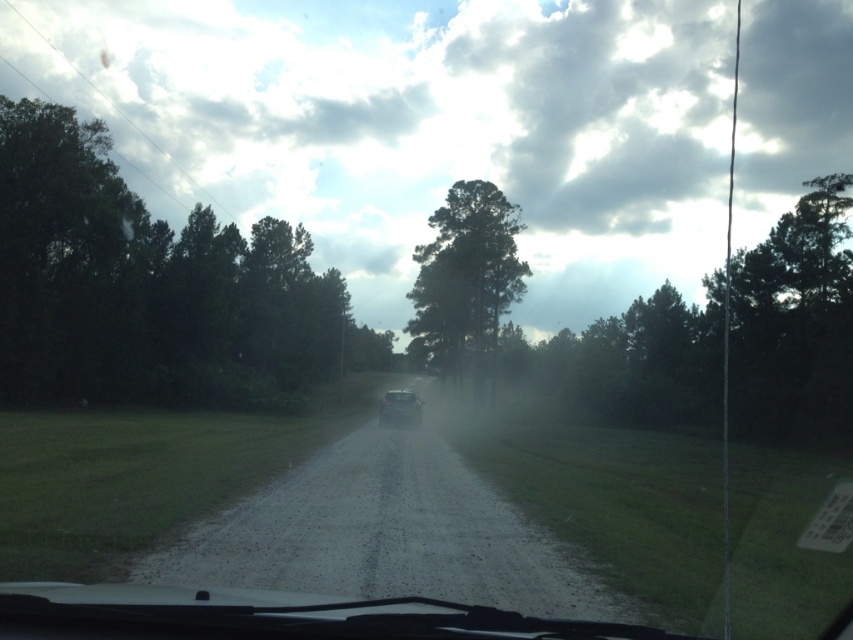
Question: Does dark green foliage at left have a greater width compared to green matte tree at center?

Choices:
 (A) no
 (B) yes

Answer: (A)

Question: Which of the following is the farthest from the observer?

Choices:
 (A) (498, 273)
 (B) (389, 419)
 (C) (242, 364)

Answer: (A)

Question: Is dark green foliage at left above shiny silver car at center?

Choices:
 (A) yes
 (B) no

Answer: (A)

Question: Considering the real-world distances, which object is farthest from the green matte tree at center?

Choices:
 (A) shiny silver car at center
 (B) dark green foliage at left

Answer: (A)

Question: Does green matte tree at center appear on the right side of shiny silver car at center?

Choices:
 (A) yes
 (B) no

Answer: (A)

Question: Which of these objects is positioned farthest from the dark green foliage at left?

Choices:
 (A) shiny silver car at center
 (B) green matte tree at center

Answer: (A)